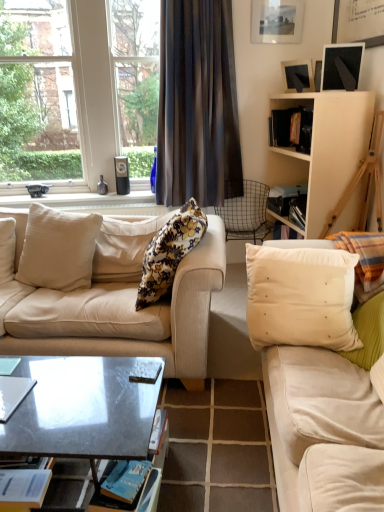
Where is `vacant space situated above metallic gray coffee table at center (from a real-world perspective)`? vacant space situated above metallic gray coffee table at center (from a real-world perspective) is located at coordinates (62, 392).